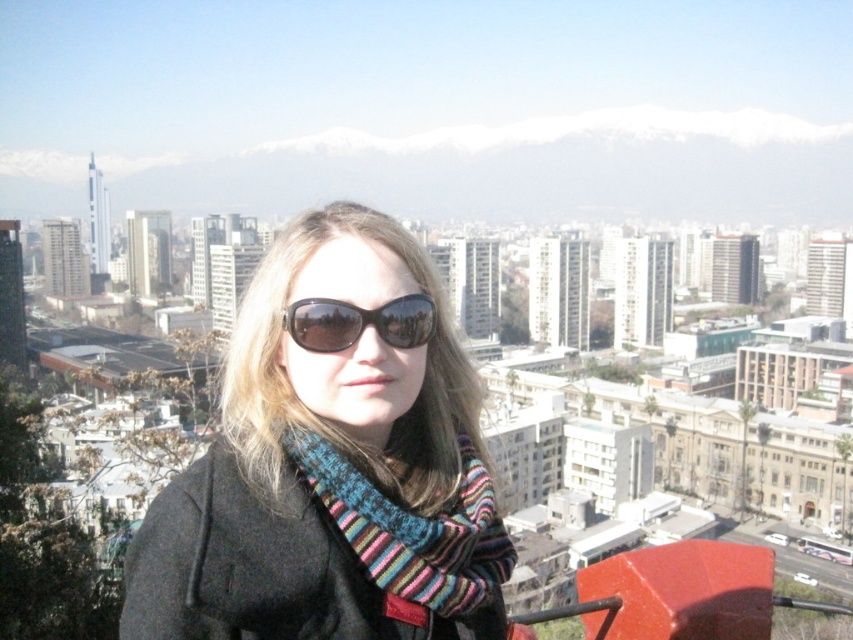
Question: Estimate the real-world distances between objects in this image. Which object is farther from the black knitted scarf at center?

Choices:
 (A) striped knit scarf at center
 (B) black plastic sunglasses at center

Answer: (B)

Question: Does striped knit scarf at center have a larger size compared to black plastic sunglasses at center?

Choices:
 (A) yes
 (B) no

Answer: (A)

Question: Considering the real-world distances, which object is closest to the black knitted scarf at center?

Choices:
 (A) striped knit scarf at center
 (B) black plastic sunglasses at center

Answer: (A)

Question: Does black knitted scarf at center appear on the right side of striped knit scarf at center?

Choices:
 (A) no
 (B) yes

Answer: (A)

Question: Based on their relative distances, which object is farther from the black knitted scarf at center?

Choices:
 (A) striped knit scarf at center
 (B) black plastic sunglasses at center

Answer: (B)

Question: From the image, what is the correct spatial relationship of black knitted scarf at center in relation to striped knit scarf at center?

Choices:
 (A) right
 (B) left

Answer: (B)